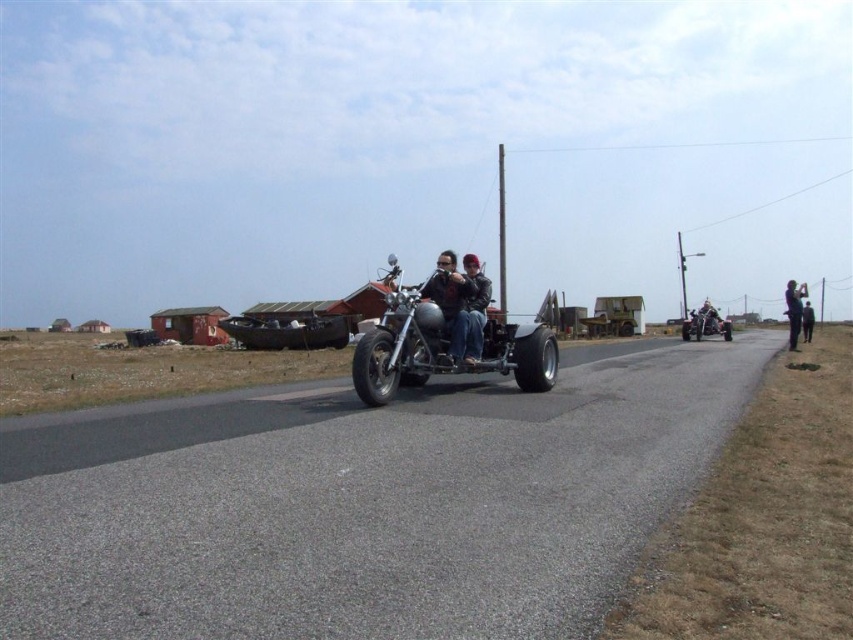
Between shiny chrome motorcycle at center and dark gray fabric jacket at right, which one appears on the right side from the viewer's perspective?

dark gray fabric jacket at right is more to the right.

Who is more distant from viewer, (489,353) or (808,323)?

Positioned behind is point (808,323).

Where is `shiny chrome motorcycle at center`? This screenshot has height=640, width=853. shiny chrome motorcycle at center is located at coordinates (447, 336).

Who is lower down, shiny chrome motorcycle at center or shiny chrome motorcycle at right?

Positioned lower is shiny chrome motorcycle at center.

This screenshot has width=853, height=640. Find the location of `shiny chrome motorcycle at center`. shiny chrome motorcycle at center is located at coordinates (447, 336).

Between point (408, 323) and point (695, 314), which one is positioned behind?

The point (695, 314) is more distant.

Locate an element on the screen. shiny chrome motorcycle at center is located at coordinates (447, 336).

Is point (465, 307) closer to viewer compared to point (479, 298)?

That is True.

Measure the distance between matte black motorcycle at center and camera.

matte black motorcycle at center is 10.66 meters away from camera.

Who is more forward, (450, 314) or (473, 268)?

Point (450, 314) is more forward.

Find the location of `matte black motorcycle at center`. matte black motorcycle at center is located at coordinates (450, 301).